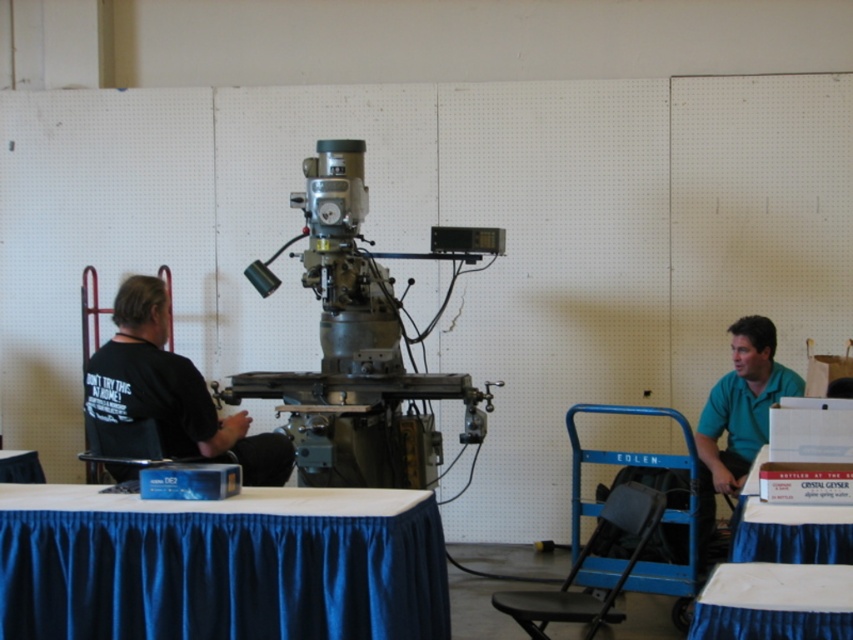
You are a maintenance worker in the workshop and need to place a heavy tool on a table. Which table, the white glossy table at lower right or the blue fabric table at lower right, would you choose based on height?

The blue fabric table at lower right is taller than the white glossy table at lower right, so you should choose the blue fabric table at lower right to place the heavy tool since it is taller and more stable.

You are organizing a small event in the workshop and need to place a centerpiece on the blue satin tablecloth at lower center. To ensure it doesn not block the view of the green matte shirt at right, should you place the centerpiece on the left or right side of the tablecloth?

The blue satin tablecloth at lower center is to the left of the green matte shirt at right. To avoid blocking the view of the green matte shirt at right, place the centerpiece on the right side of the blue satin tablecloth at lower center so it doesn not obstruct the line of sight towards the shirt.